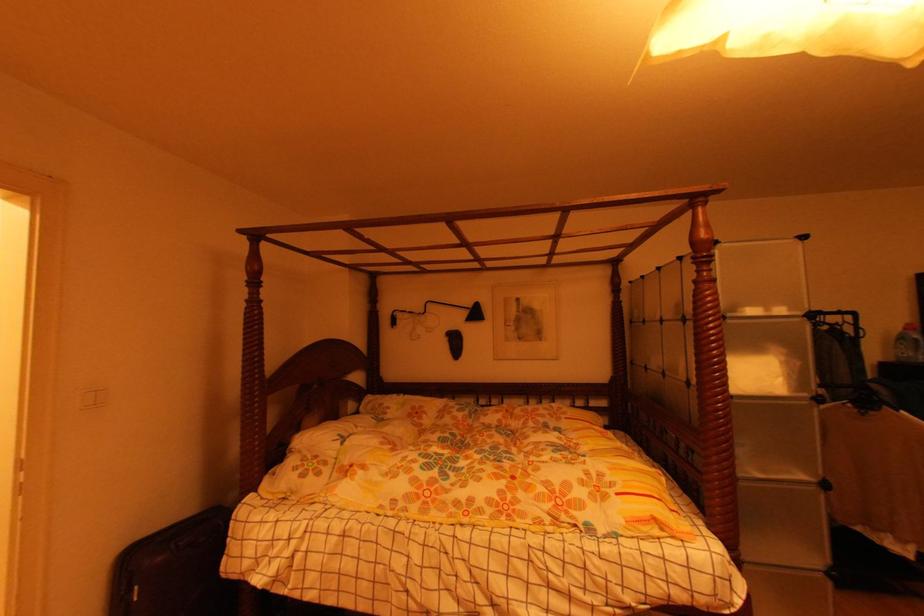
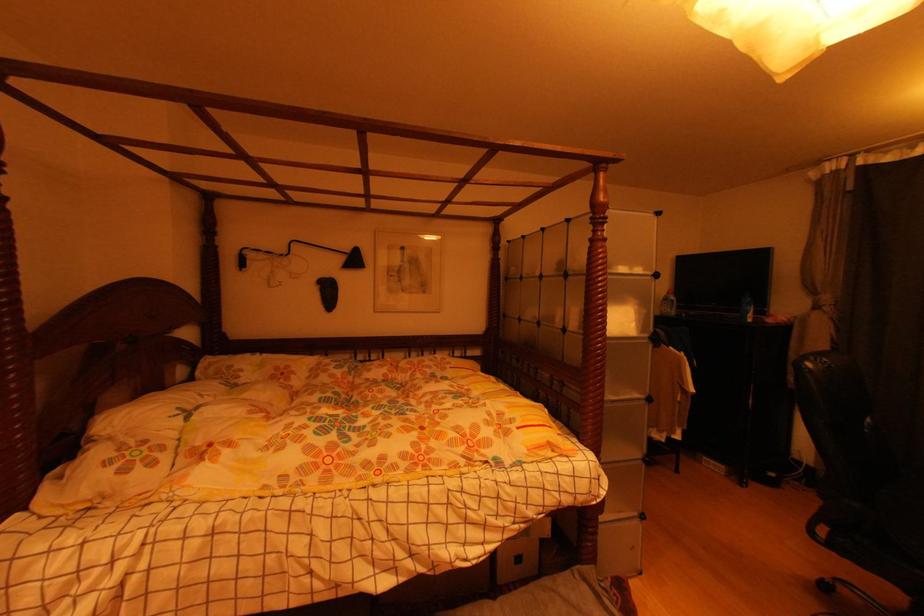
Question: The images are taken continuously from a first-person perspective. In which direction is your viewpoint rotating?

Choices:
 (A) Left
 (B) Right
 (C) Up
 (D) Down

Answer: (B)